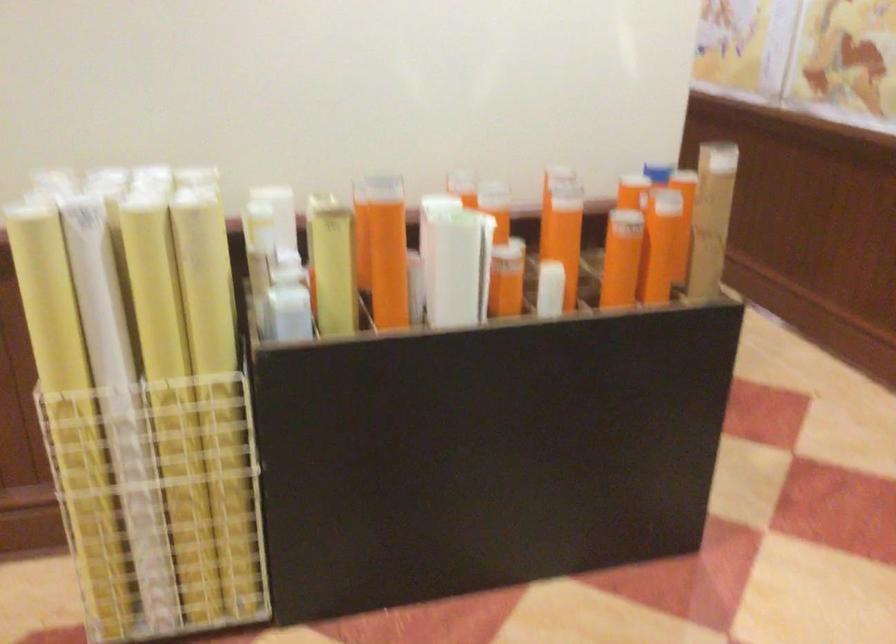
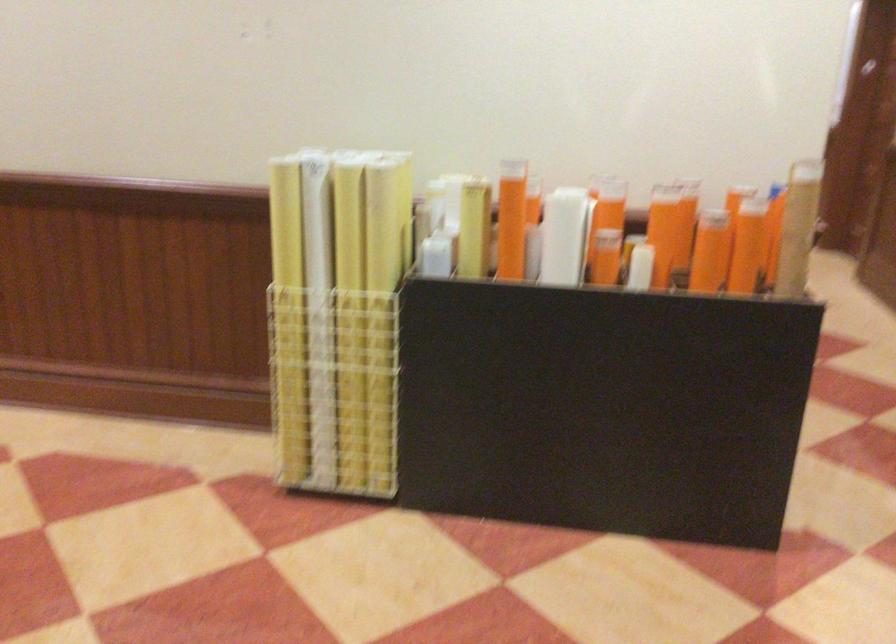
In the second image, find the point that corresponds to [78,431] in the first image.

(288, 317)